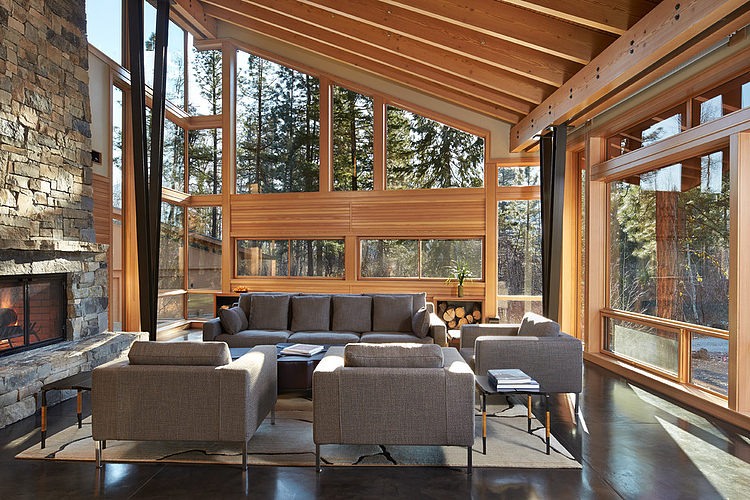
I want to click on rug, so click(x=526, y=448).